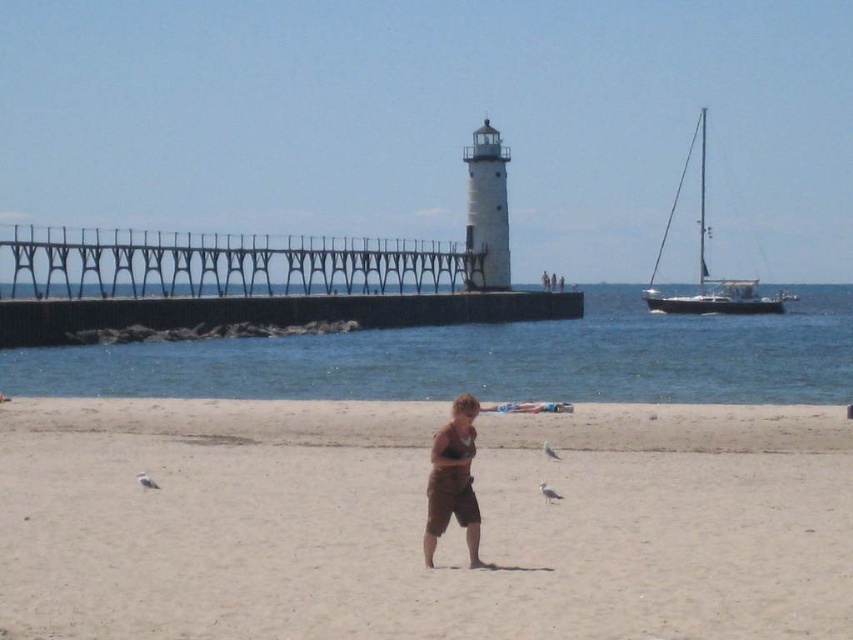
You are standing on the beach and see the point marked at coordinates (270,314). What structure is this point located on?

The point marked at coordinates (270,314) is located on the dark gray concrete pier at center.

You are a photographer planning to take a photo of the dark gray concrete pier at center and the white sailboat at right in the beach scene. Considering the distance between them, will you need to adjust your camera settings to focus on both objects simultaneously?

The dark gray concrete pier at center and the white sailboat at right are 96.02 feet apart. To focus on both objects simultaneously, you would need to ensure your camera has a sufficient depth of field. This can be achieved by using a small aperture setting, which increases the range of acceptable focus. Alternatively, you might consider positioning yourself so both objects are at a similar distance from the camera or use postprocessing techniques to blend focused areas.